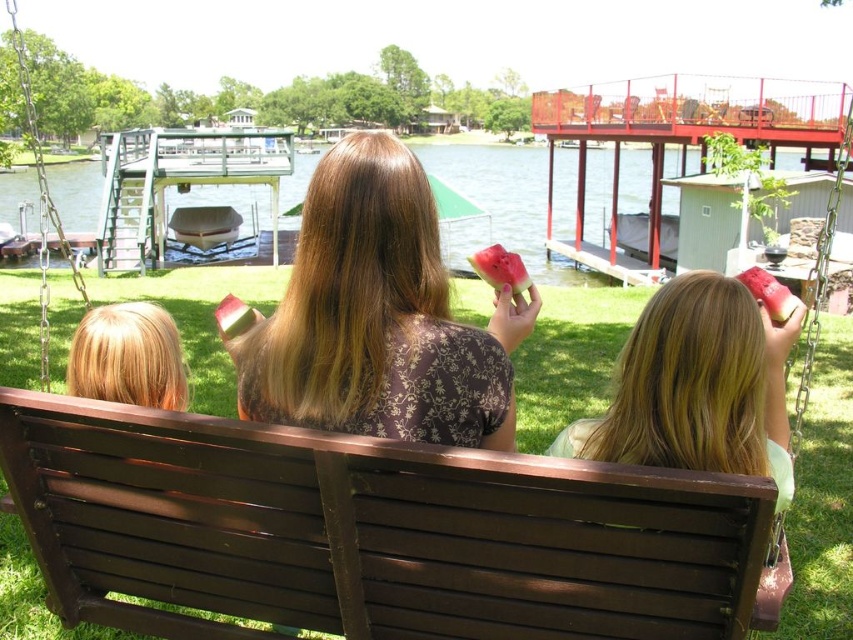
The image size is (853, 640). Describe the element at coordinates (497, 202) in the screenshot. I see `green grass at center` at that location.

Can you confirm if green grass at center is thinner than brushed metal boat at center?

No, green grass at center is not thinner than brushed metal boat at center.

Identify the location of green grass at center. Image resolution: width=853 pixels, height=640 pixels. (497, 202).

At what (x,y) coordinates should I click in order to perform the action: click on green grass at center. Please return your answer as a coordinate pair (x, y). The height and width of the screenshot is (640, 853). Looking at the image, I should click on (497, 202).

Who is shorter, brown floral shirt at center or green grass at center?

brown floral shirt at center is shorter.

Can you confirm if brown floral shirt at center is wider than green grass at center?

No, brown floral shirt at center is not wider than green grass at center.

Where is `brown floral shirt at center`? The image size is (853, 640). brown floral shirt at center is located at coordinates (378, 316).

Who is positioned more to the right, brown wooden bench at center or brushed metal boat at center?

brown wooden bench at center is more to the right.

Does brown wooden bench at center appear over brushed metal boat at center?

Actually, brown wooden bench at center is below brushed metal boat at center.

This screenshot has width=853, height=640. In order to click on brown wooden bench at center in this screenshot , I will do `click(368, 531)`.

Where is `brown wooden bench at center`? brown wooden bench at center is located at coordinates (x=368, y=531).